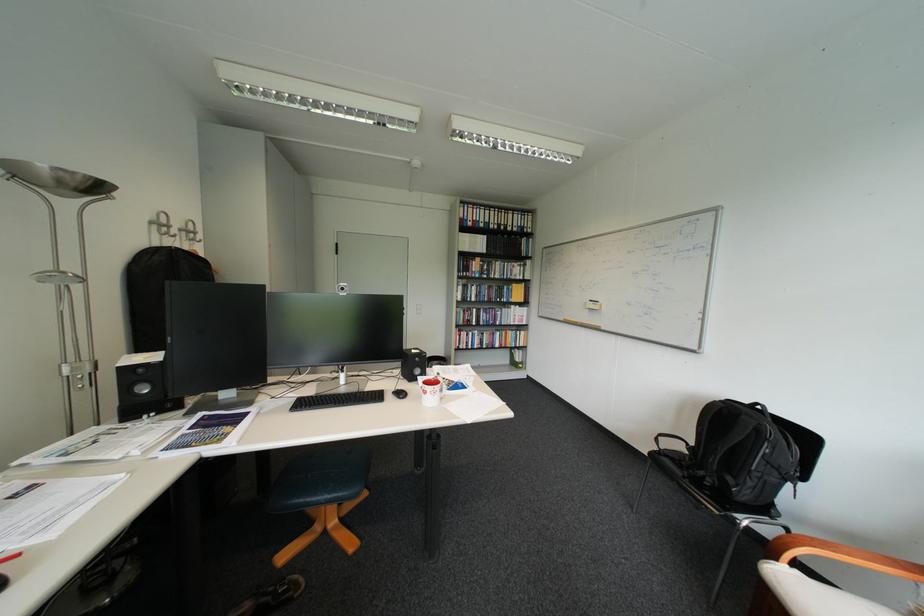
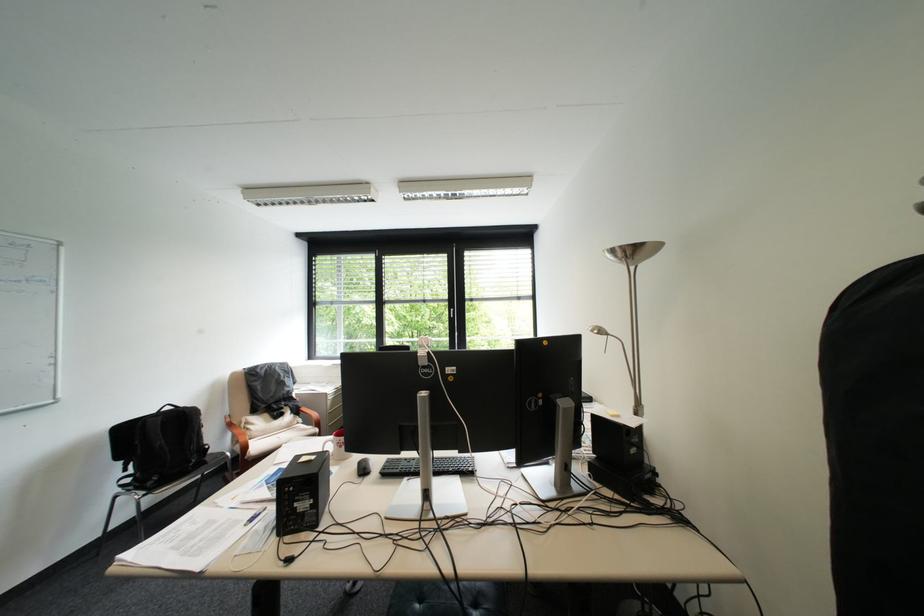
In the second image, find the point that corresponds to [756,418] in the first image.

(198, 411)